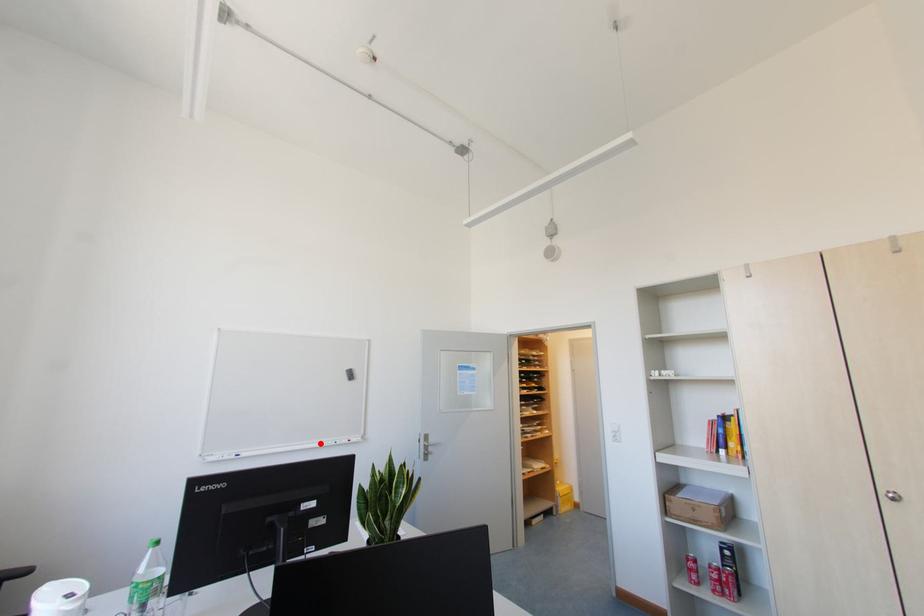
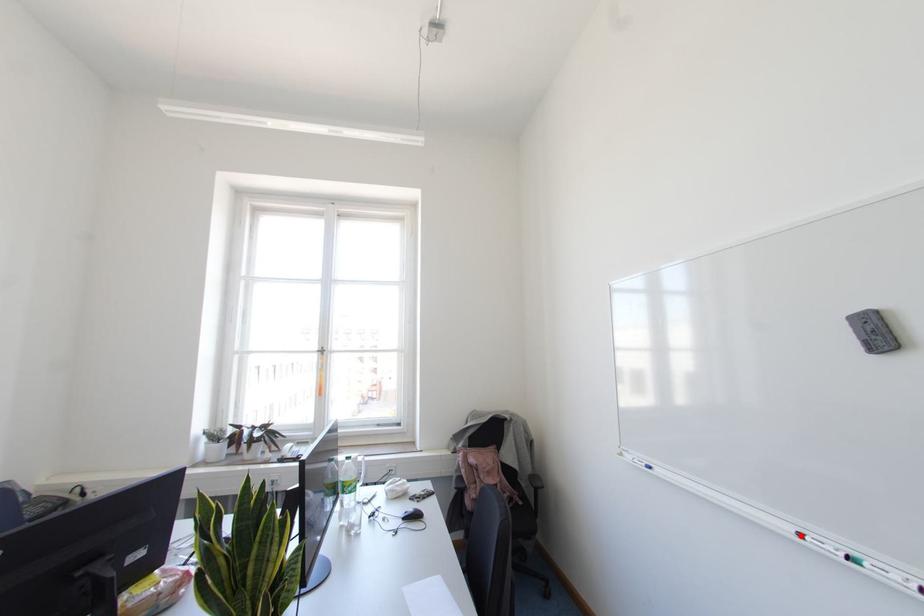
I am providing you with two images of the same scene from different viewpoints. A red point is marked on the first image and another point is marked on the second image. Is the marked point in image1 the same physical position as the marked point in image2?

Yes